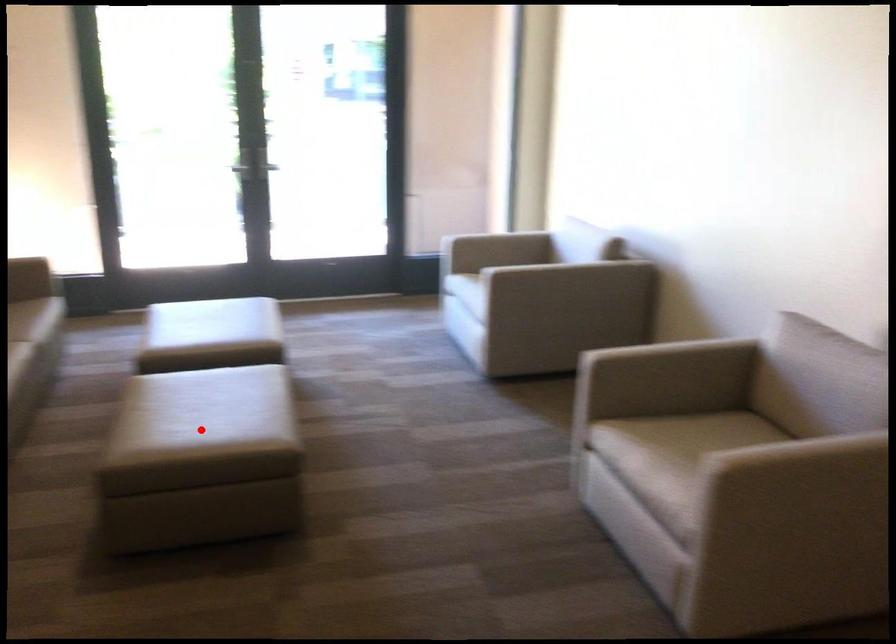
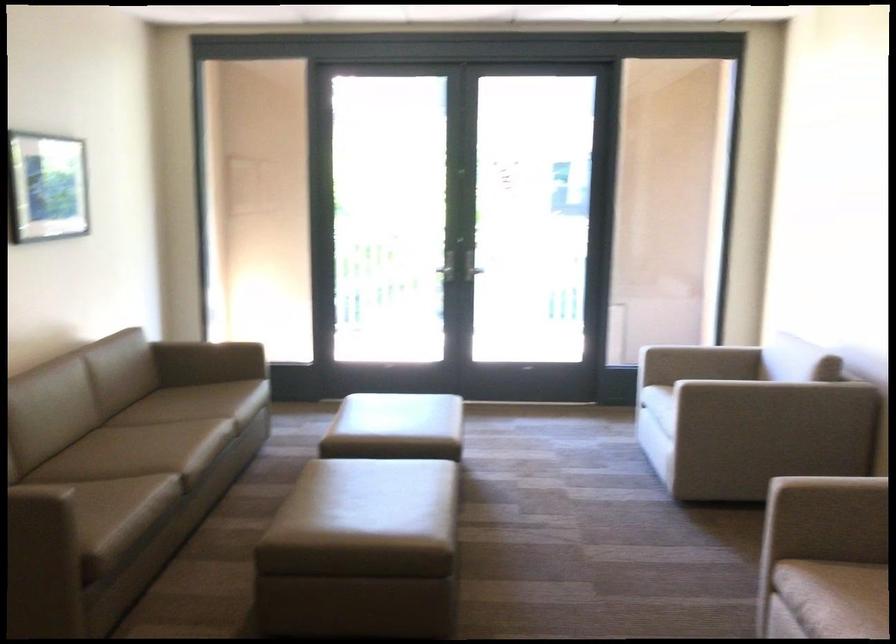
Find the pixel in the second image that matches the highlighted location in the first image.

(367, 521)